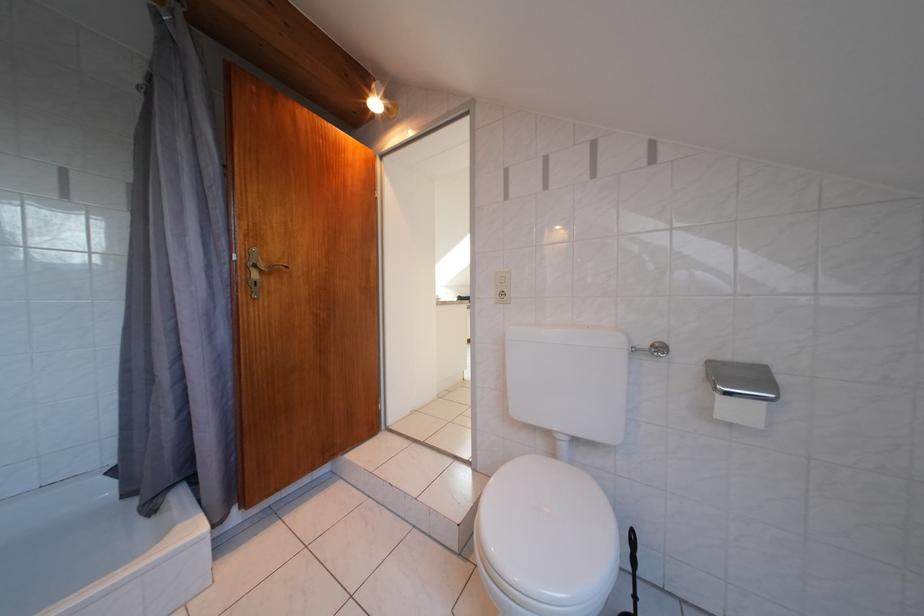
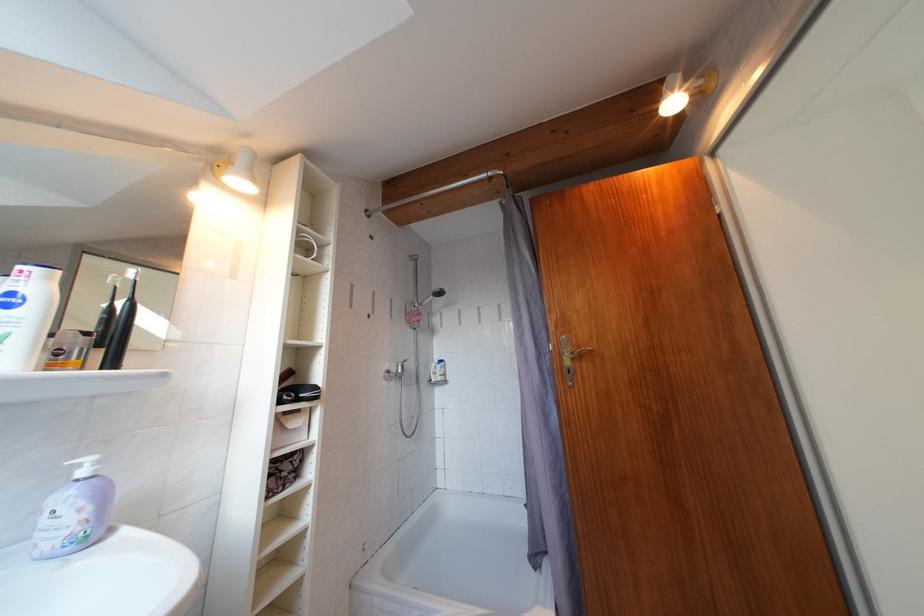
The point at (244, 264) is marked in the first image. Where is the corresponding point in the second image?

(560, 354)